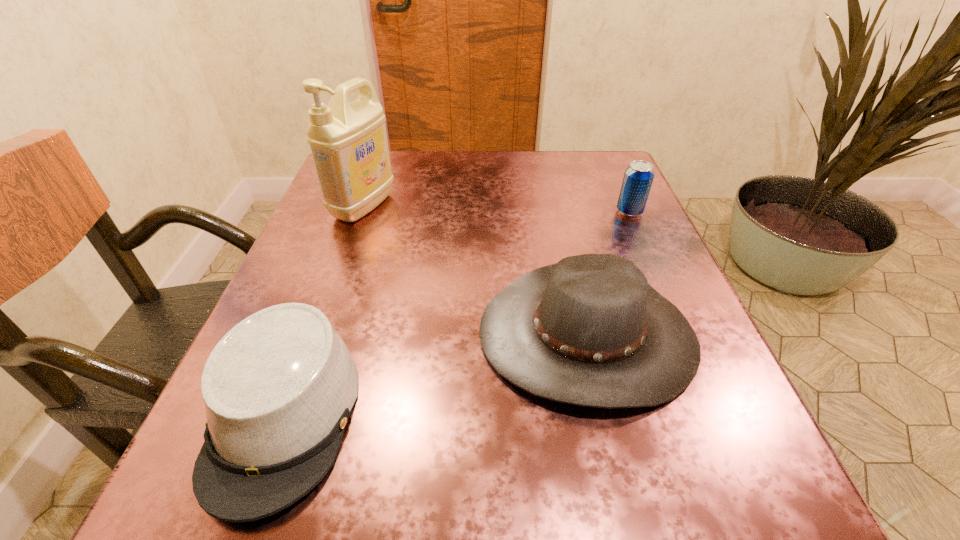
At what (x,y) coordinates should I click in order to perform the action: click on free point between the taller hat and the detergent. Please return your answer as a coordinate pair (x, y). Image resolution: width=960 pixels, height=540 pixels. Looking at the image, I should click on (475, 271).

The width and height of the screenshot is (960, 540). Identify the location of vacant area that lies between the right hat and the left hat. (436, 375).

Find the location of a particular element. The height and width of the screenshot is (540, 960). free space between the taller hat and the shorter hat is located at coordinates [436, 375].

Find the location of `free space between the detergent and the beer can`. free space between the detergent and the beer can is located at coordinates (496, 209).

I want to click on free spot between the left hat and the tallest object, so click(324, 310).

The width and height of the screenshot is (960, 540). Identify the location of vacant region between the shorter hat and the beer can. (457, 313).

You are a GUI agent. You are given a task and a screenshot of the screen. Output one action in this format:
    pyautogui.click(x=<x>, y=<y>)
    Task: Click on the empty location between the detergent and the taller hat
    The height and width of the screenshot is (540, 960).
    Given the screenshot: What is the action you would take?
    pyautogui.click(x=475, y=271)

This screenshot has height=540, width=960. I want to click on empty space that is in between the shorter hat and the detergent, so click(x=324, y=310).

In order to click on object that is the second nearest to the shorter hat in this screenshot , I will do `click(348, 141)`.

Identify the location of object that stands as the closest to the tallest object. The height and width of the screenshot is (540, 960). (589, 330).